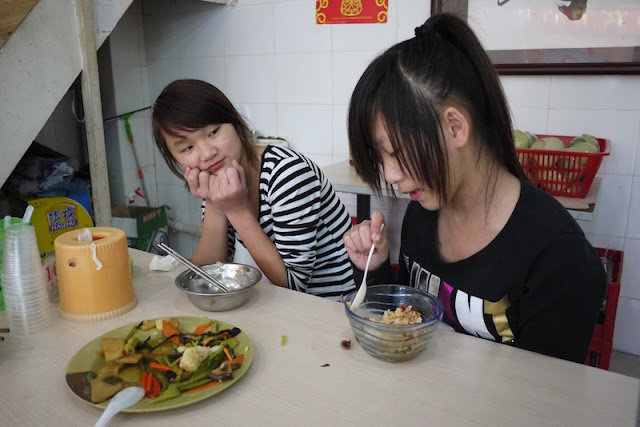
The image size is (640, 427). I want to click on crumpled napkin, so click(x=164, y=262).